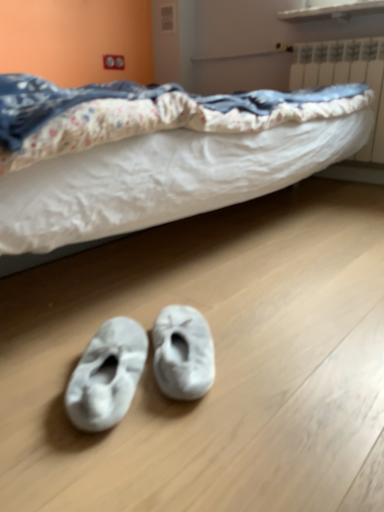
Question: In the image, is white fuzzy slippers at lower center, the 1th footwear positioned from the left, on the left side or the right side of white plastic radiator at upper right?

Choices:
 (A) right
 (B) left

Answer: (B)

Question: In terms of width, does white fuzzy slippers at lower center, which is the second footwear from right to left, look wider or thinner when compared to white plastic radiator at upper right?

Choices:
 (A) thin
 (B) wide

Answer: (B)

Question: Which is farther from the white fuzzy slippers at lower center, which is the second footwear from right to left?

Choices:
 (A) white fuzzy slippers at lower center, the 1th footwear viewed from the right
 (B) white plastic radiator at upper right

Answer: (B)

Question: Based on their relative distances, which object is nearer to the white fuzzy slippers at lower center, the 1th footwear viewed from the right?

Choices:
 (A) white fuzzy slippers at lower center, which is the second footwear from right to left
 (B) white plastic radiator at upper right

Answer: (A)